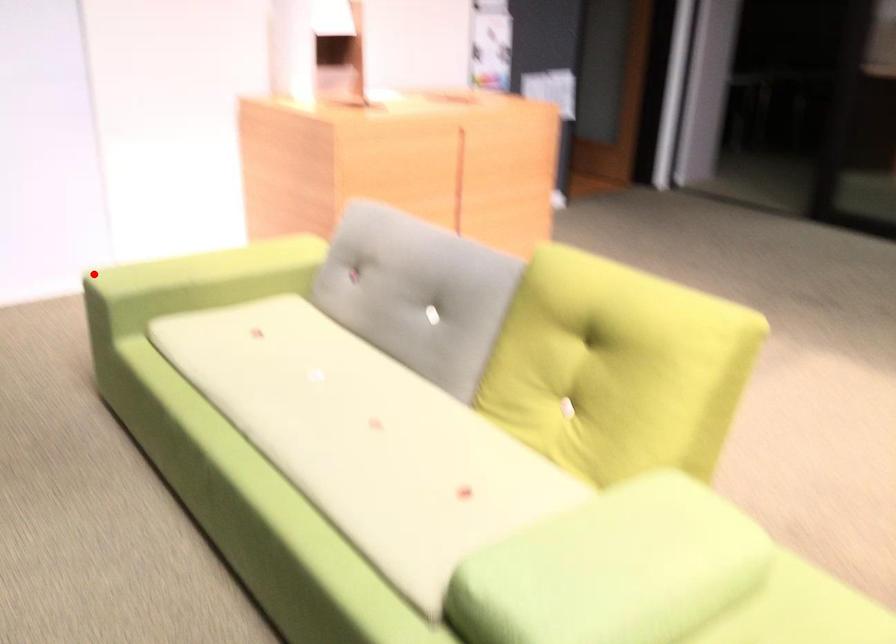
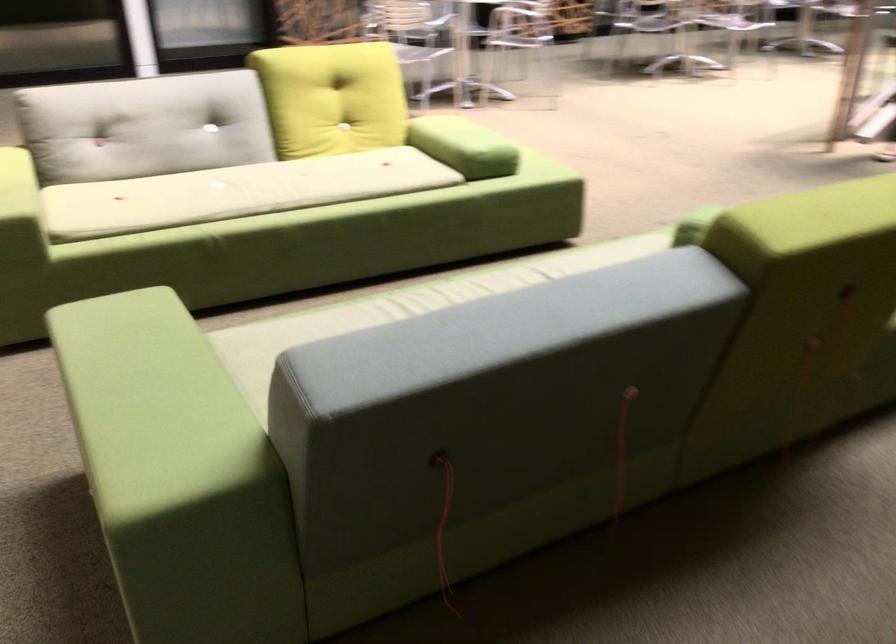
In the second image, find the point that corresponds to the highlighted location in the first image.

(19, 207)